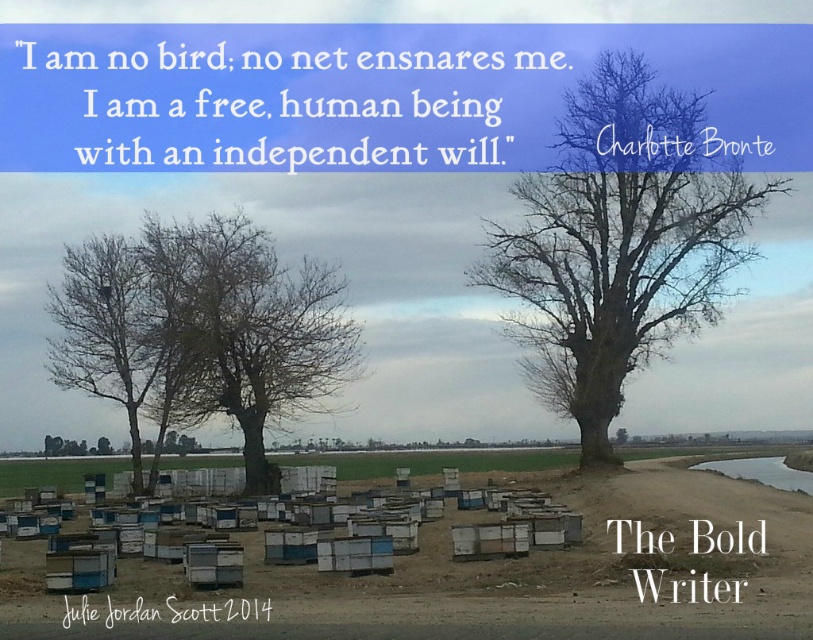
Question: Is bare bark tree at right wider than bare wood tree at center?

Choices:
 (A) no
 (B) yes

Answer: (B)

Question: Does bare bark tree at right appear on the right side of bare wood tree at center?

Choices:
 (A) no
 (B) yes

Answer: (B)

Question: Does bare bark tree at right appear over bare wood tree at center?

Choices:
 (A) no
 (B) yes

Answer: (B)

Question: Among these points, which one is nearest to the camera?

Choices:
 (A) (555, 403)
 (B) (320, 396)

Answer: (B)